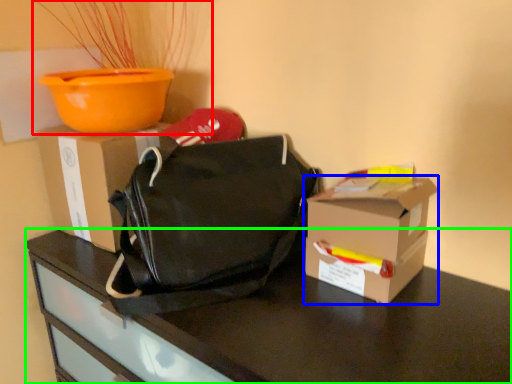
Question: Considering the real-world distances, which object is closest to houseplant (highlighted by a red box)? box (highlighted by a blue box) or desk (highlighted by a green box).

Choices:
 (A) box
 (B) desk

Answer: (B)